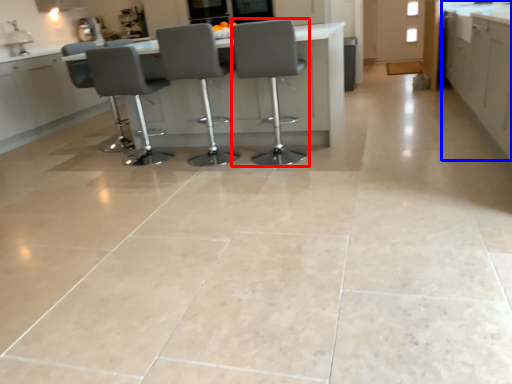
Question: Which object is further to the camera taking this photo, chair (highlighted by a red box) or cabinetry (highlighted by a blue box)?

Choices:
 (A) chair
 (B) cabinetry

Answer: (A)